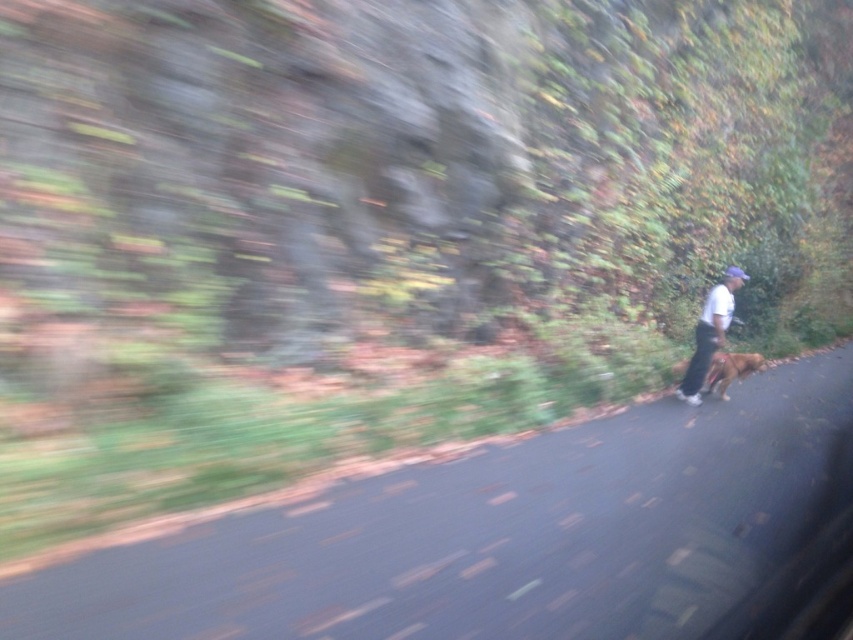
In the scene shown: Is white matte shirt at center bigger than brown furry dog at right?

Correct, white matte shirt at center is larger in size than brown furry dog at right.

Measure the distance between white matte shirt at center and brown furry dog at right.

white matte shirt at center is 15.84 inches from brown furry dog at right.

The width and height of the screenshot is (853, 640). What do you see at coordinates (711, 332) in the screenshot? I see `white matte shirt at center` at bounding box center [711, 332].

At what (x,y) coordinates should I click in order to perform the action: click on white matte shirt at center. Please return your answer as a coordinate pair (x, y). Looking at the image, I should click on (711, 332).